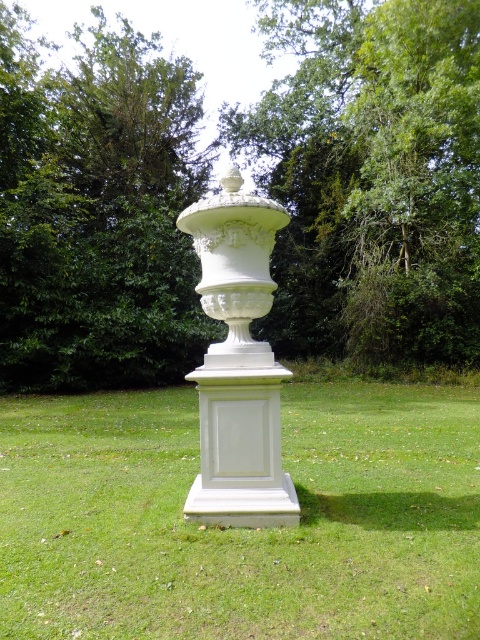
Between green leafy tree at center and green leafy tree at upper left, which one is positioned lower?

green leafy tree at upper left is below.

Does point (64, 243) come behind point (151, 320)?

Yes, point (64, 243) is farther from viewer.

Image resolution: width=480 pixels, height=640 pixels. I want to click on green leafy tree at center, so click(372, 179).

Can you confirm if white smooth pedestal at center is wider than green leafy tree at upper left?

Yes.

Is white smooth pedestal at center further to camera compared to green leafy tree at upper left?

No, white smooth pedestal at center is in front of green leafy tree at upper left.

Image resolution: width=480 pixels, height=640 pixels. What do you see at coordinates (241, 529) in the screenshot?
I see `white smooth pedestal at center` at bounding box center [241, 529].

Where is `white smooth pedestal at center`? The image size is (480, 640). white smooth pedestal at center is located at coordinates (241, 529).

Can you confirm if green leafy tree at center is bigger than white glossy urn at center?

Correct, green leafy tree at center is larger in size than white glossy urn at center.

Can you confirm if green leafy tree at center is positioned below white glossy urn at center?

Incorrect, green leafy tree at center is not positioned below white glossy urn at center.

Locate an element on the screen. The width and height of the screenshot is (480, 640). green leafy tree at center is located at coordinates (372, 179).